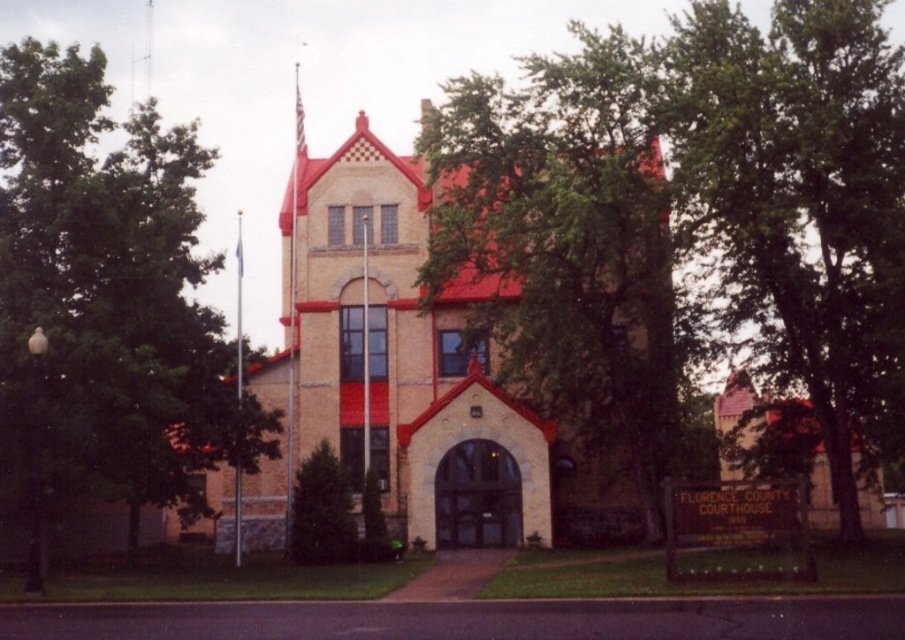
You are standing at the entrance of the Florence County Courthouse and notice a point marked at coordinates (105, 304). What object is located at that point?

The point at coordinates (105, 304) marks a green leafy tree at left.